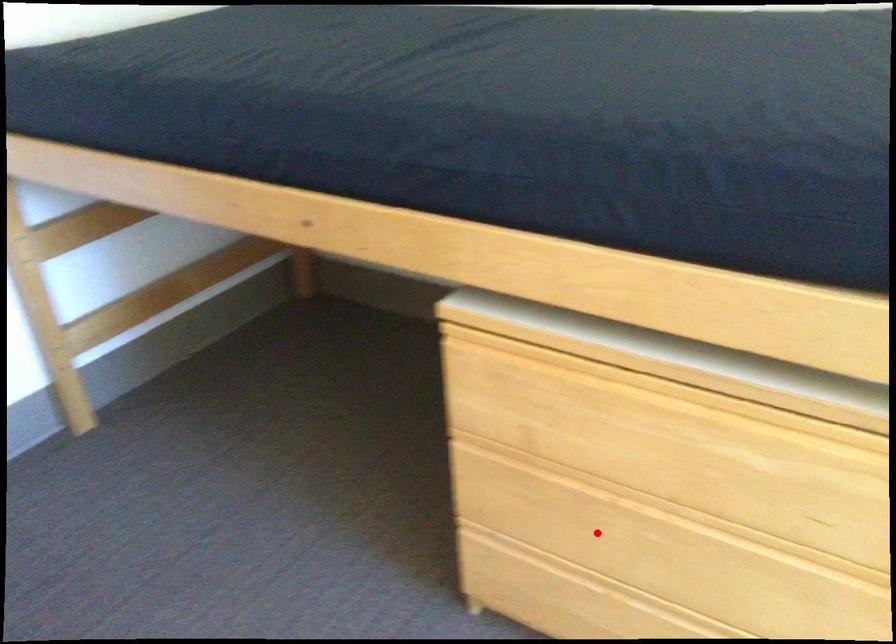
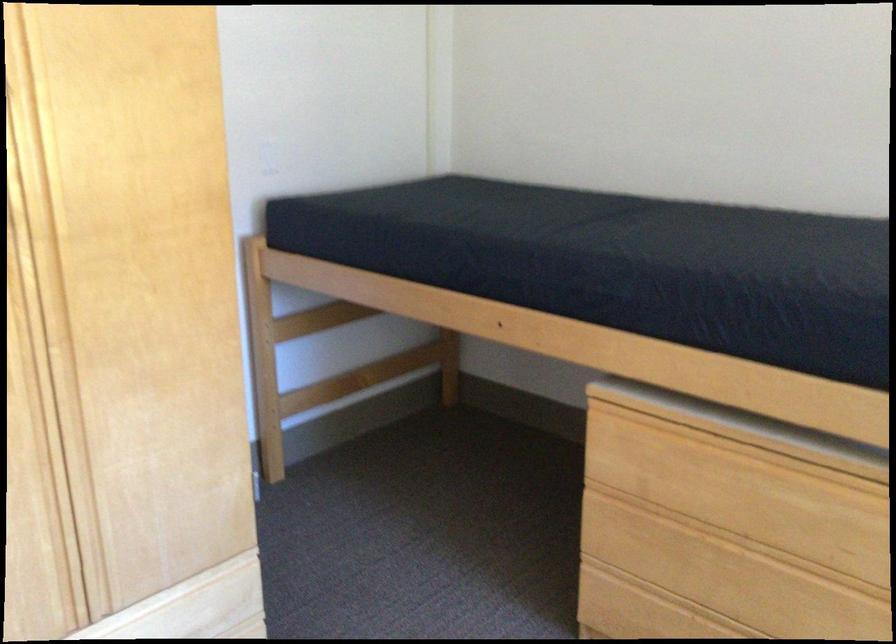
In the second image, find the point that corresponds to the highlighted location in the first image.

(699, 574)